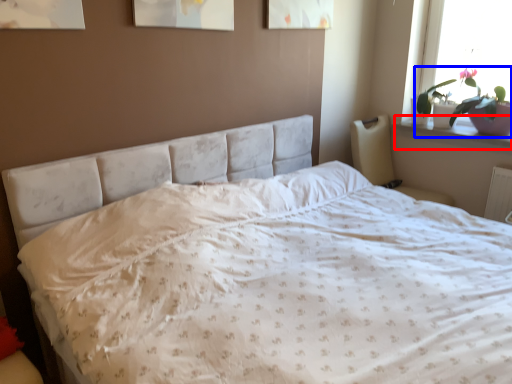
Question: Which object appears farthest to the camera in this image, window sill (highlighted by a red box) or houseplant (highlighted by a blue box)?

Choices:
 (A) window sill
 (B) houseplant

Answer: (A)